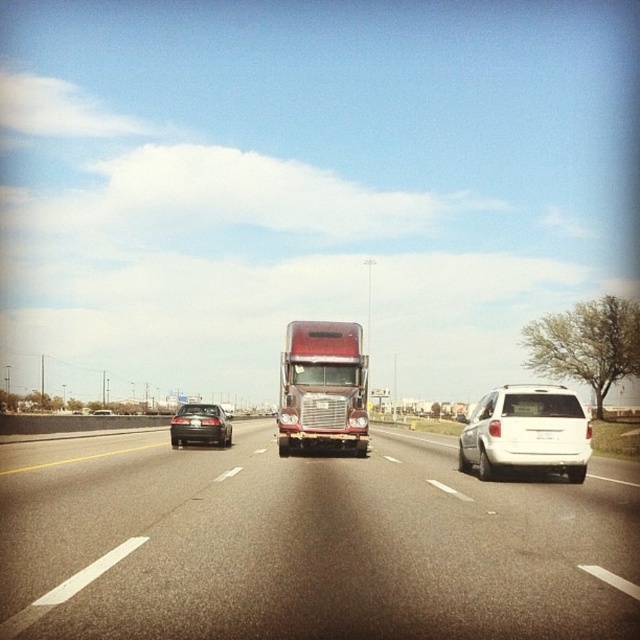
You are a driver approaching the highway scene. You need to determine if the point at coordinates (525, 432) falls on the white matte suv at right. Is this true?

Yes, the point at coordinates (525, 432) is on the white matte suv at right according to the description.

You are driving a car and see the metallic silver truck at center and the shiny black sedan at left. Which vehicle is positioned to the right side of the other?

The metallic silver truck at center is to the right of the shiny black sedan at left.

You are a driver looking at the highway scene. You need to read the license plate of the white plastic license plate at center. Where exactly is the license plate located in terms of coordinates?

The white plastic license plate at center is located at coordinates point (545, 435).